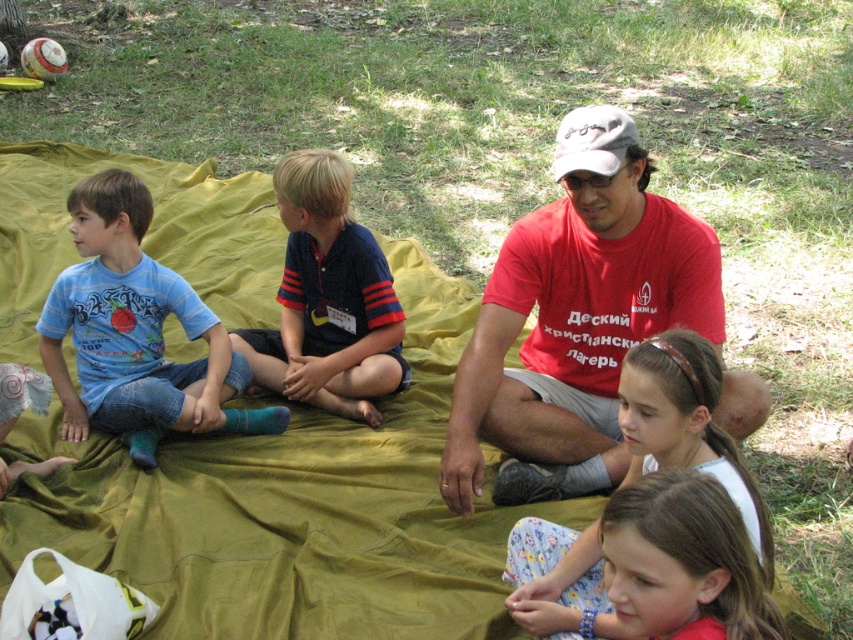
Is blue denim jeans at left smaller than floral fabric pants at lower center?

Indeed, blue denim jeans at left has a smaller size compared to floral fabric pants at lower center.

Can you confirm if blue denim jeans at left is shorter than floral fabric pants at lower center?

Incorrect, blue denim jeans at left's height does not fall short of floral fabric pants at lower center's.

Is point (78, 340) positioned before point (750, 483)?

That is False.

At what (x,y) coordinates should I click in order to perform the action: click on blue denim jeans at left. Please return your answer as a coordinate pair (x, y). Image resolution: width=853 pixels, height=640 pixels. Looking at the image, I should click on (136, 332).

Can you confirm if red cotton shirt at center is positioned to the left of blue denim jeans at left?

Incorrect, red cotton shirt at center is not on the left side of blue denim jeans at left.

Who is positioned more to the left, red cotton shirt at center or blue denim jeans at left?

From the viewer's perspective, blue denim jeans at left appears more on the left side.

Where is `red cotton shirt at center`? The image size is (853, 640). red cotton shirt at center is located at coordinates 575,320.

Locate an element on the screen. This screenshot has height=640, width=853. red cotton shirt at center is located at coordinates tap(575, 320).

Consider the image. Can you confirm if blue striped polo shirt at center is positioned above floral fabric pants at lower center?

Correct, blue striped polo shirt at center is located above floral fabric pants at lower center.

Can you confirm if blue striped polo shirt at center is bigger than floral fabric pants at lower center?

No, blue striped polo shirt at center is not bigger than floral fabric pants at lower center.

The height and width of the screenshot is (640, 853). Describe the element at coordinates (328, 298) in the screenshot. I see `blue striped polo shirt at center` at that location.

This screenshot has width=853, height=640. In order to click on blue striped polo shirt at center in this screenshot , I will do `click(328, 298)`.